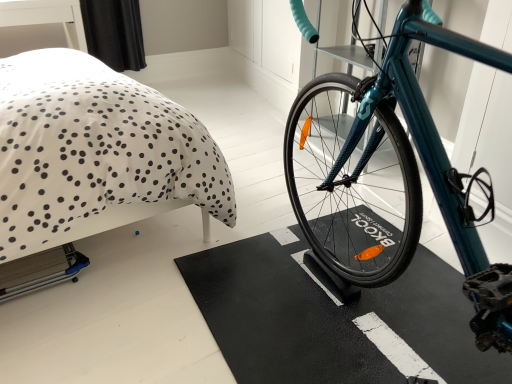
Where is `vacant space that is to the left of black rubber bath mat at center`? The image size is (512, 384). vacant space that is to the left of black rubber bath mat at center is located at coordinates (134, 295).